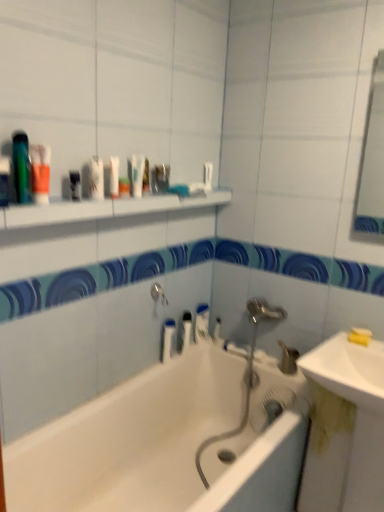
Question: From the image's perspective, is white glossy bathtub at center over white plastic mouthwash at upper center, the 3th mouthwash from the left?

Choices:
 (A) yes
 (B) no

Answer: (B)

Question: Can you see white glossy bathtub at center touching white plastic mouthwash at upper center, the 3th mouthwash from the left?

Choices:
 (A) yes
 (B) no

Answer: (B)

Question: Does white glossy bathtub at center have a greater width compared to white plastic mouthwash at upper center, acting as the 3th mouthwash starting from the front?

Choices:
 (A) yes
 (B) no

Answer: (A)

Question: Is white glossy bathtub at center shorter than white plastic mouthwash at upper center, placed as the third mouthwash when sorted from top to bottom?

Choices:
 (A) yes
 (B) no

Answer: (B)

Question: Is white glossy bathtub at center looking in the opposite direction of white plastic mouthwash at upper center, arranged as the fifth mouthwash when viewed from the back?

Choices:
 (A) yes
 (B) no

Answer: (B)

Question: Would you consider white glossy bathtub at center to be distant from white plastic mouthwash at upper center, arranged as the fifth mouthwash when viewed from the back?

Choices:
 (A) no
 (B) yes

Answer: (B)

Question: Does white glossy sink at lower right, the first sink from the top, have a greater height compared to matte plastic container at upper center, the first toiletry viewed from the top?

Choices:
 (A) yes
 (B) no

Answer: (A)

Question: Is white glossy sink at lower right, the first sink from the top, shorter than matte plastic container at upper center, the second toiletry when ordered from right to left?

Choices:
 (A) no
 (B) yes

Answer: (A)

Question: Are white glossy sink at lower right, the first sink from the top, and matte plastic container at upper center, the 2th toiletry from the bottom, far apart?

Choices:
 (A) no
 (B) yes

Answer: (B)

Question: Does white glossy sink at lower right, which is the second sink in bottom-to-top order, have a lesser width compared to matte plastic container at upper center, the first toiletry viewed from the top?

Choices:
 (A) yes
 (B) no

Answer: (B)

Question: Is white glossy sink at lower right, which is the second sink in bottom-to-top order, smaller than matte plastic container at upper center, marked as the second toiletry in a back-to-front arrangement?

Choices:
 (A) no
 (B) yes

Answer: (A)

Question: Considering the relative positions of white glossy sink at lower right, which is the second sink in bottom-to-top order, and matte plastic container at upper center, marked as the second toiletry in a back-to-front arrangement, in the image provided, is white glossy sink at lower right, which is the second sink in bottom-to-top order, to the right of matte plastic container at upper center, marked as the second toiletry in a back-to-front arrangement, from the viewer's perspective?

Choices:
 (A) yes
 (B) no

Answer: (A)

Question: Considering the relative sizes of matte plastic container at upper center, the first toiletry viewed from the top, and white glossy toothpaste at upper center, the first toothpaste from the top, in the image provided, is matte plastic container at upper center, the first toiletry viewed from the top, taller than white glossy toothpaste at upper center, the first toothpaste from the top,?

Choices:
 (A) yes
 (B) no

Answer: (B)